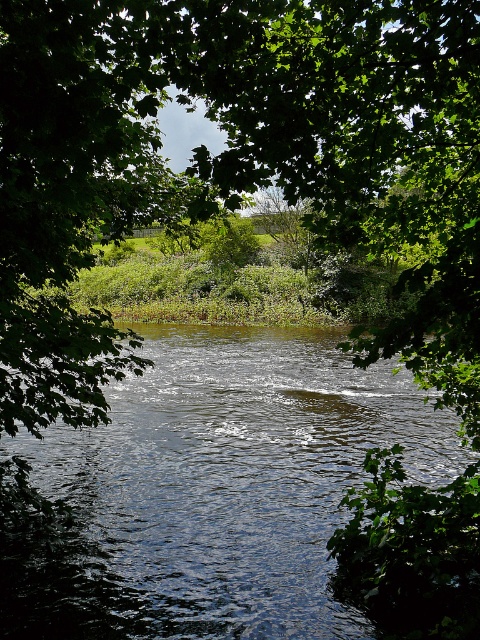
You are planning to set up a small tent for a picnic. You need to choose a spot that is sheltered from the rain. Which object between the green leafy tree at center and the dark blue water at center would provide better shelter?

The green leafy tree at center is much taller than the dark blue water at center, so it would provide better shelter from the rain as its height allows it to block more rain.

You are standing on the riverbank and want to cross the river using a small boat. The boat can only hold up to two people. You see the green leafy tree at center and the dark blue water at center. Which object should you avoid when navigating the boat to reach the opposite bank safely?

You should avoid the green leafy tree at center when navigating the boat to reach the opposite bank safely because it is positioned over the dark blue water at center, which means the tree might be blocking the path or creating obstacles in the water.